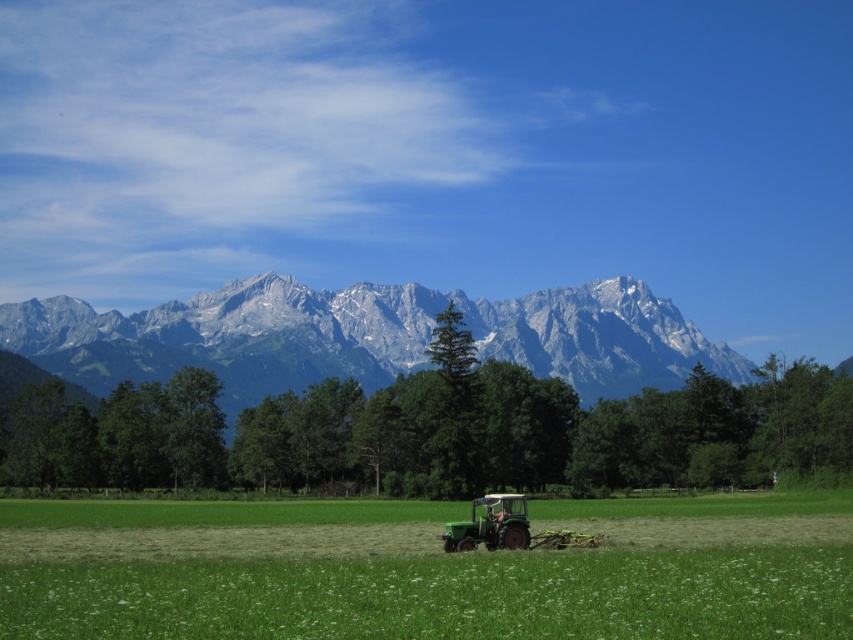
Is point (567, 596) in front of point (468, 544)?

Yes, point (567, 596) is in front of point (468, 544).

Is green grass at center to the left of green matte tractor at lower center from the viewer's perspective?

Correct, you'll find green grass at center to the left of green matte tractor at lower center.

Is point (355, 518) positioned after point (468, 544)?

Yes.

Locate an element on the screen. green grass at center is located at coordinates (425, 570).